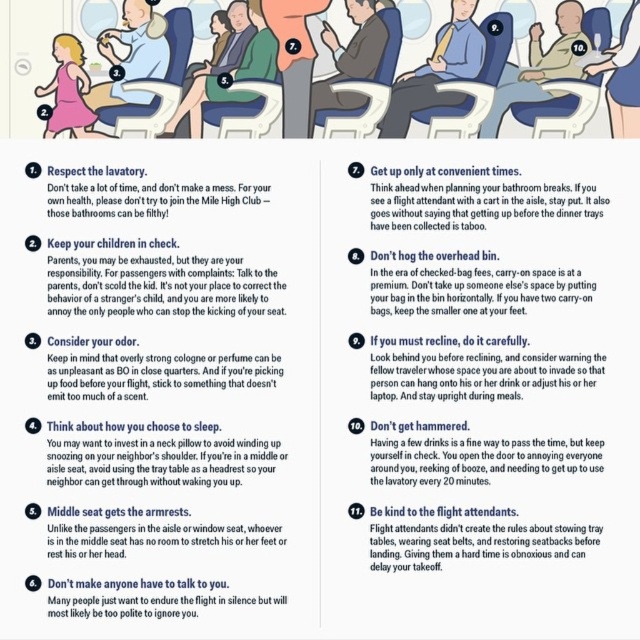
You are designing a poster for airplane etiquette and need to place the matte black text at upper left and the matte black laptop at upper right. The airline requires that all elements must be at least 12 inches apart for readability. Based on the scene provided, will the current placement meet the airline requirement?

The matte black text at upper left and the matte black laptop at upper right are 15.35 inches apart, which exceeds the required 12 inches, so the placement meets the airline requirement.

You are a flight attendant preparing to serve drinks to passengers in the airplane cabin. You notice the white paper text at upper center in the top panel. Where should you look to find this text?

The white paper text at upper center is located at point (x=468, y=365) in the top panel.

You are looking at an informational poster about airplane etiquette. The poster has two panels. In the top panel, there are numbered passengers in an airplane cabin. In the bottom panel, there are two elements labeled with matte black text at upper left and a matte black laptop at upper right. Based on the poster, which object in the bottom panel is bigger?

The matte black text at upper left is larger in size compared to the matte black laptop at upper right according to the description.